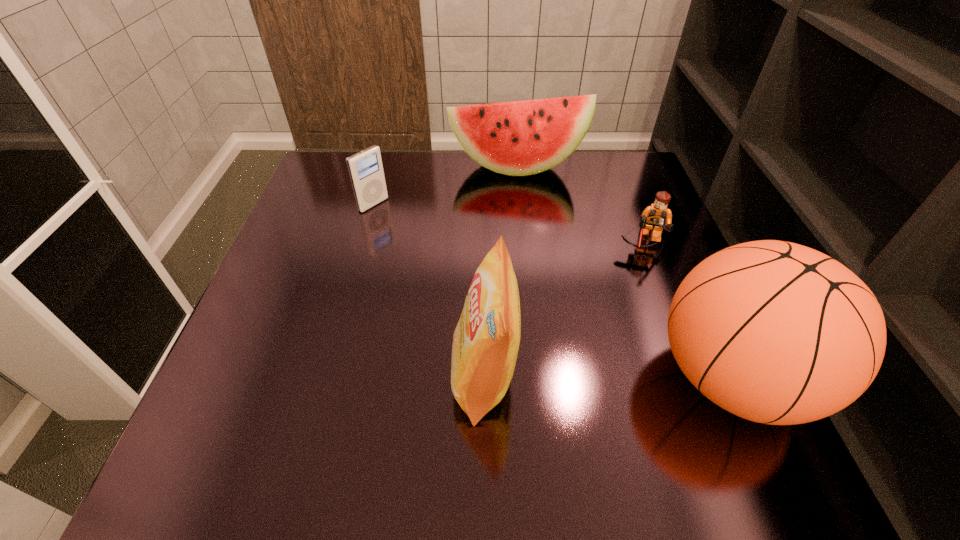
Find the location of a particular element. The height and width of the screenshot is (540, 960). vacant point located between the basketball and the fourth tallest object is located at coordinates (552, 291).

I want to click on vacant area between the third shortest object and the shortest object, so click(581, 205).

Where is `vacant space that's between the farthest object and the basketball`? The image size is (960, 540). vacant space that's between the farthest object and the basketball is located at coordinates pos(624,272).

I want to click on object that stands as the fourth closest to the watermelon, so click(x=486, y=340).

Where is `object that is the third closest to the crisp (potato chip)`? Image resolution: width=960 pixels, height=540 pixels. object that is the third closest to the crisp (potato chip) is located at coordinates (365, 168).

Locate an element on the screen. The width and height of the screenshot is (960, 540). vacant space that satisfies the following two spatial constraints: 1. on the front side of the Lego; 2. on the right side of the basketball is located at coordinates (696, 376).

Find the location of a particular element. vacant space that satisfies the following two spatial constraints: 1. on the front side of the basketball; 2. on the left side of the watermelon is located at coordinates (538, 376).